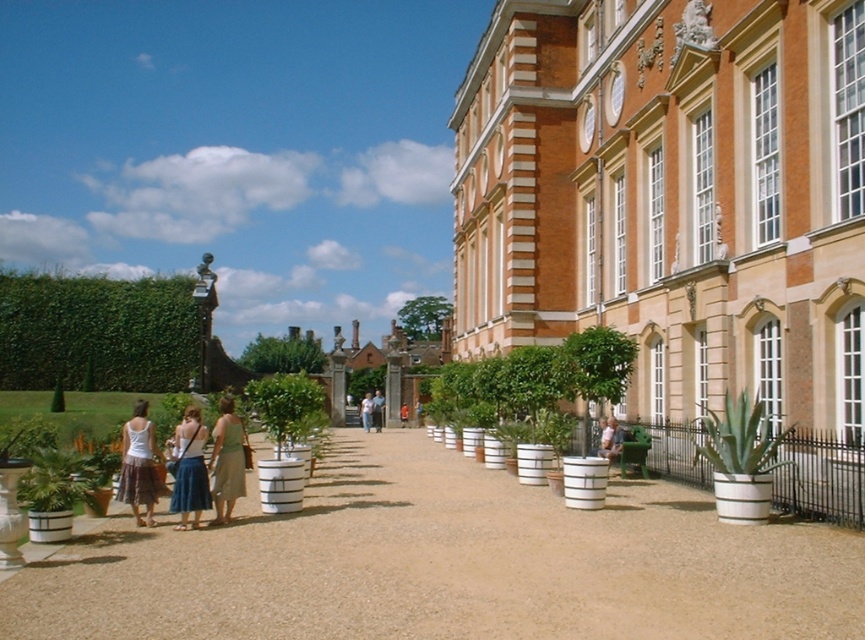
You are standing at the entrance of the building and see a green fabric dress at center and a light blue denim skirt at center. Which clothing item is positioned higher from the ground?

The green fabric dress at center is located above the light blue denim skirt at center, so it is positioned higher from the ground.

You are a photographer setting up equipment on the pathway. You need to place a tripod between the green leafy plant at right and the light blue denim skirt at center. Which object should you position the tripod closer to to ensure it fits within the available space?

The light blue denim denim skirt at center has a smaller width than the green leafy plant at right, so positioning the tripod closer to the light blue denim skirt at center would provide more space for the tripod.